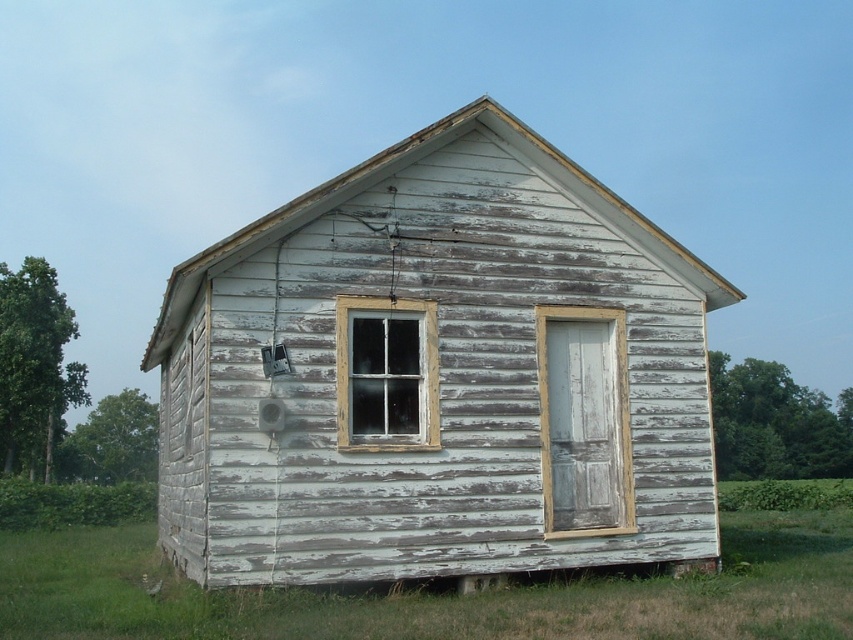
Question: Does weathered wood window at center come in front of clear glass window at center?

Choices:
 (A) no
 (B) yes

Answer: (A)

Question: In this image, where is weathered wood window at center located relative to clear glass window at center?

Choices:
 (A) right
 (B) left

Answer: (A)

Question: Which point is closer to the camera taking this photo?

Choices:
 (A) (561, 376)
 (B) (399, 308)

Answer: (B)

Question: Which object is the closest to the white weathered wood hut at center?

Choices:
 (A) white weathered wood at lower right
 (B) clear glass window at center
 (C) weathered wood window at center

Answer: (B)

Question: Which of the following is the closest to the observer?

Choices:
 (A) (357, 381)
 (B) (271, 588)
 (C) (230, 401)

Answer: (B)

Question: Is white weathered wood hut at center wider than weathered wood window at center?

Choices:
 (A) yes
 (B) no

Answer: (A)